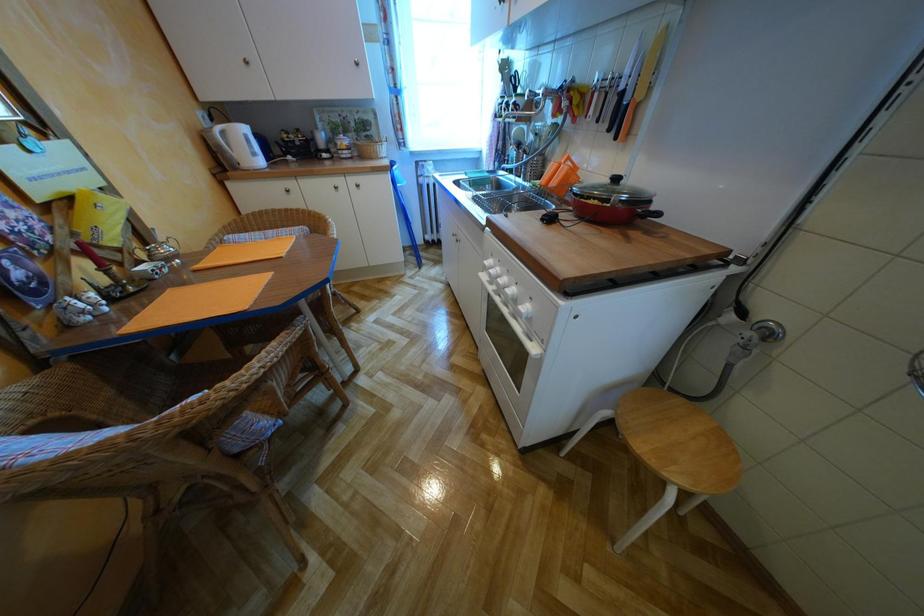
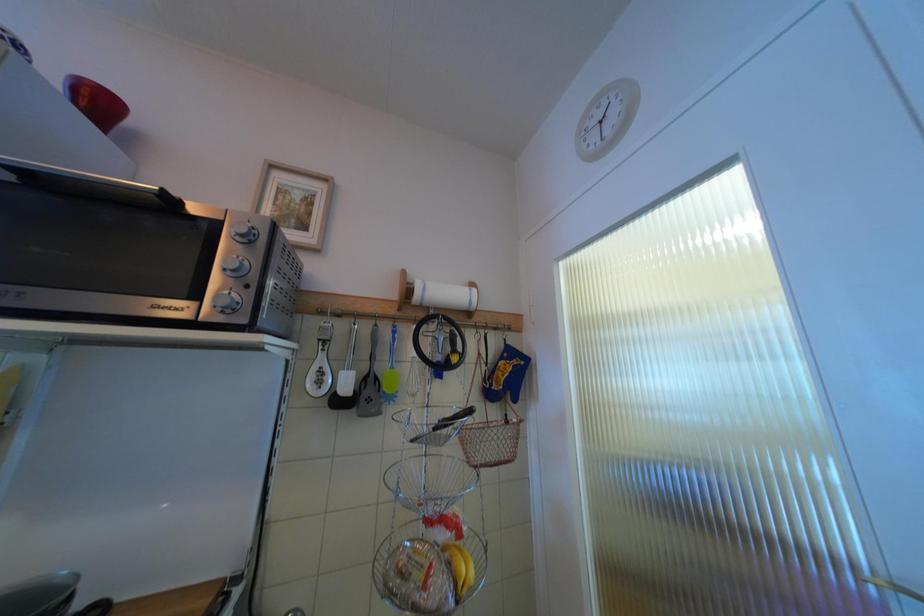
Question: The camera is either moving clockwise (left) or counter-clockwise (right) around the object. The first image is from the beginning of the video and the second image is from the end. Is the camera moving left or right when shooting the video?

Choices:
 (A) Left
 (B) Right

Answer: (A)